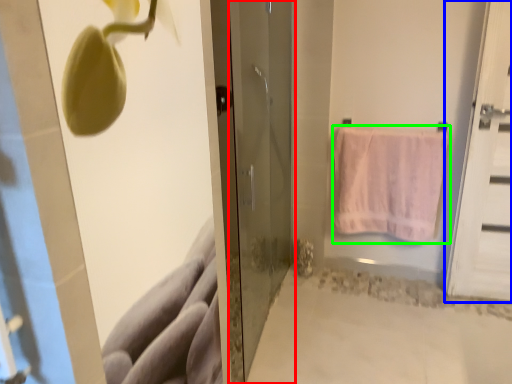
Question: Based on their relative distances, which object is nearer to door (highlighted by a red box)? Choose from door (highlighted by a blue box) and towel (highlighted by a green box).

Choices:
 (A) door
 (B) towel

Answer: (B)